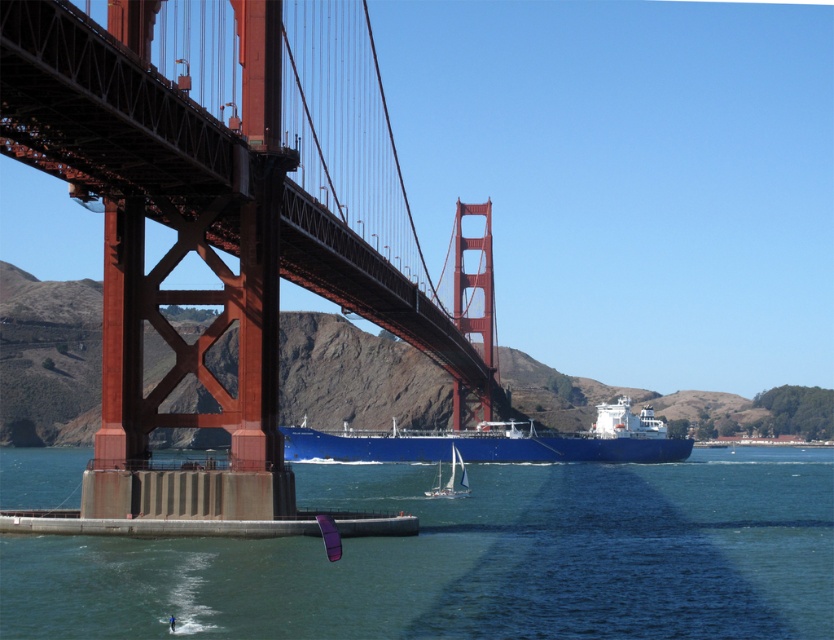
Looking at this image, you are a photographer standing at the Golden Gate Bridge. You have two points marked in your viewfinder. The first point is at coordinates point [806,621] and the second is at point [589,442]. Which point is nearer to your camera lens?

Point [806,621] is closer to the camera lens than point [589,442].

From the picture: You are standing at the point marked by the coordinates point (196, 243). What structure are you on?

The point (196, 243) is on the red steel suspension bridge at center, so you are standing on the red steel suspension bridge at center.

You are a photographer planning to capture a photo of the red steel suspension bridge at center and the blue matte ship at center from a position on the shore. Given that the bridge is taller than the ship, will the ship be fully visible in the photo if you position yourself so that the bridge occupies the left side of the frame?

The red steel suspension bridge at center is taller than the blue matte ship at center. Since the bridge is positioned to the left in the frame, the ship will still be fully visible as its height is shorter, allowing it to be seen beneath or alongside the bridge without obstruction.